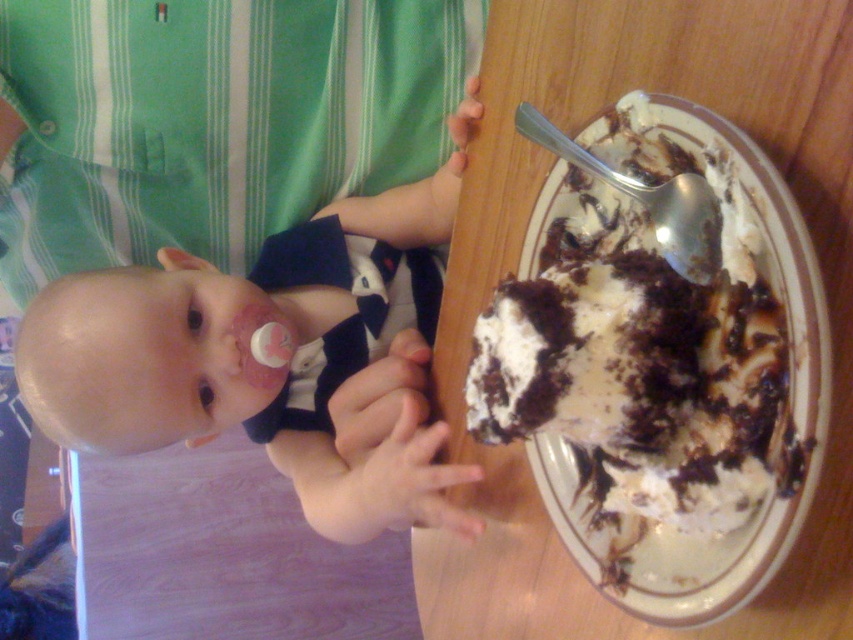
Does pink pacifier at left appear over white glazed porcelain at right?

Yes, pink pacifier at left is above white glazed porcelain at right.

Which is more to the left, pink pacifier at left or white glazed porcelain at right?

pink pacifier at left

In order to click on pink pacifier at left in this screenshot , I will do `click(263, 360)`.

Image resolution: width=853 pixels, height=640 pixels. I want to click on pink pacifier at left, so click(x=263, y=360).